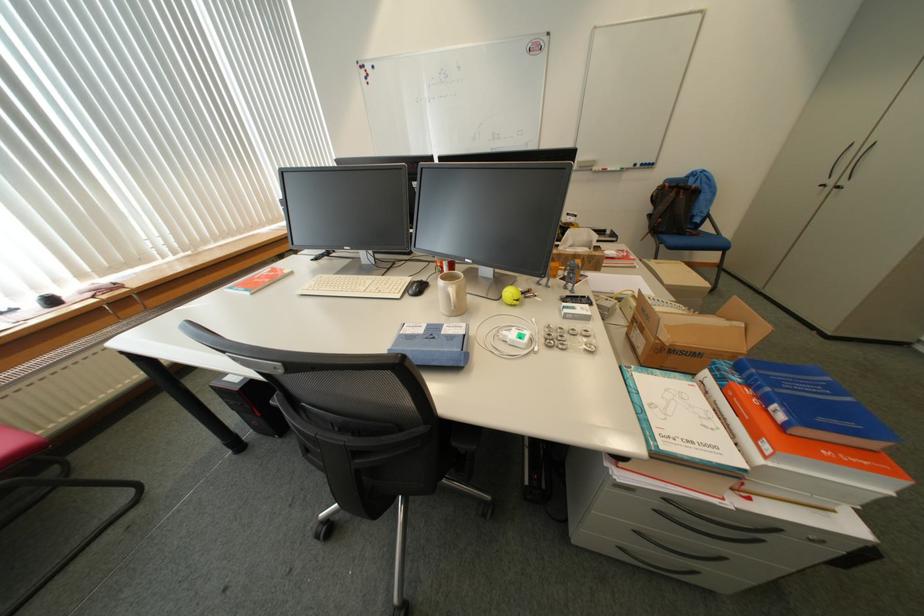
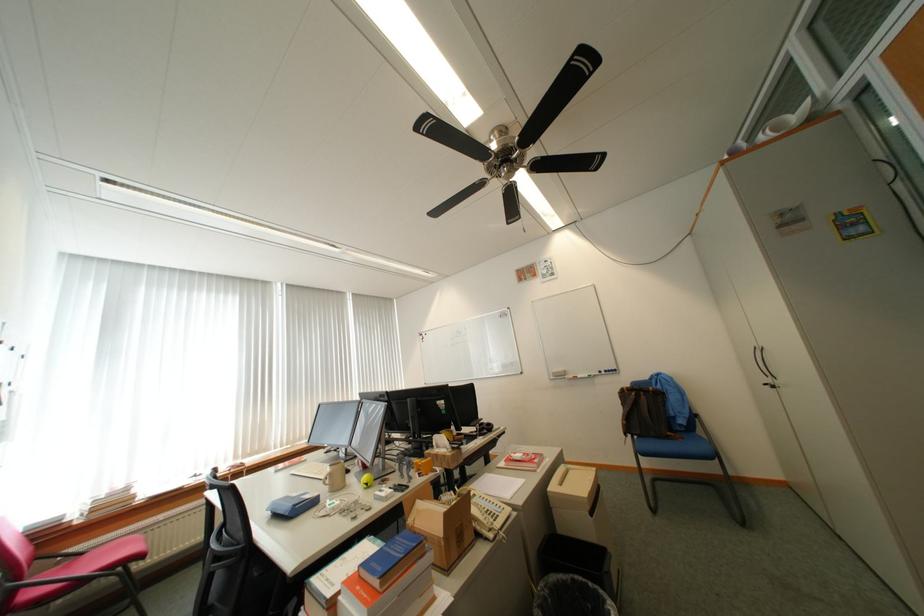
Where in the second image is the point corresponding to pixel 715 229 from the first image?

(709, 432)